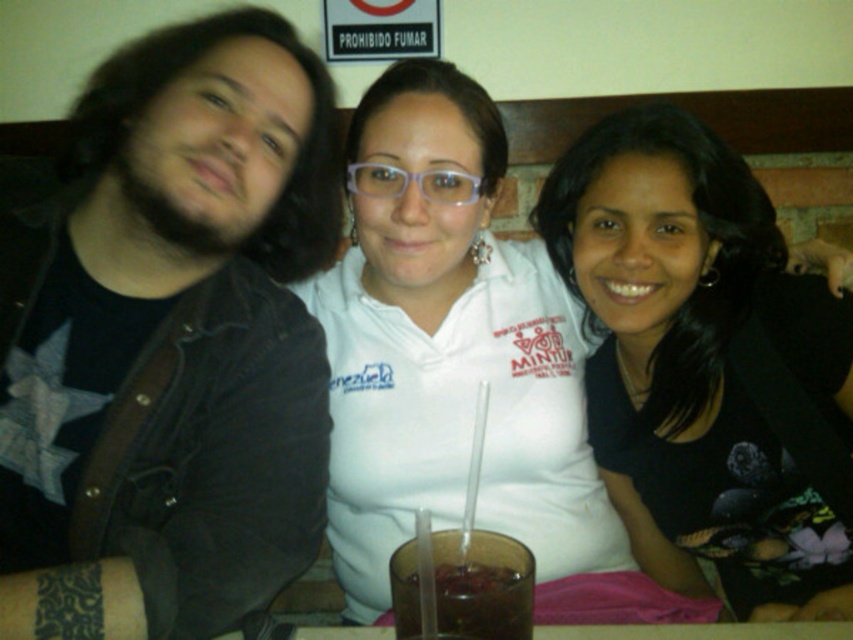
Question: Which point is closer to the camera?

Choices:
 (A) black matte shirt at center
 (B) dark denim jacket at left
 (C) brown translucent glass at center

Answer: (C)

Question: Can you confirm if dark denim jacket at left is positioned to the right of brown translucent glass at center?

Choices:
 (A) yes
 (B) no

Answer: (B)

Question: Does dark denim jacket at left appear under brown translucent glass at center?

Choices:
 (A) no
 (B) yes

Answer: (A)

Question: Which object appears closest to the camera in this image?

Choices:
 (A) black matte shirt at center
 (B) brown translucent glass at center

Answer: (B)

Question: Estimate the real-world distances between objects in this image. Which object is closer to the black matte shirt at center?

Choices:
 (A) dark denim jacket at left
 (B) brown translucent glass at center

Answer: (A)

Question: In this image, where is dark denim jacket at left located relative to black matte shirt at center?

Choices:
 (A) below
 (B) above

Answer: (B)